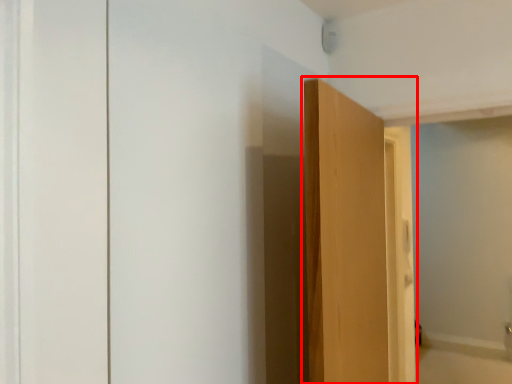
Question: Where is door (annotated by the red box) located in relation to bath in the image?

Choices:
 (A) right
 (B) left

Answer: (B)